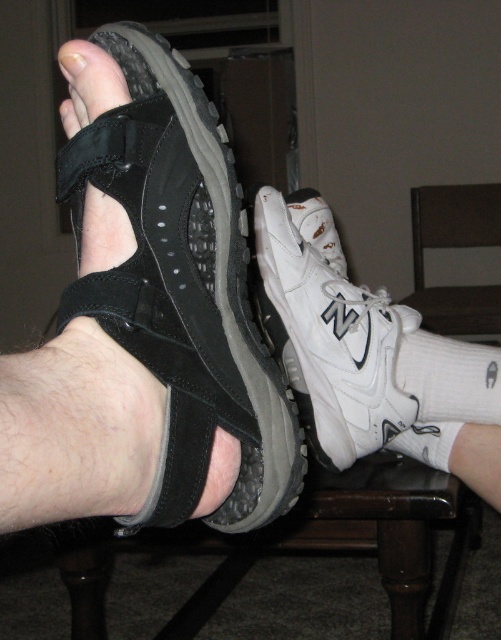
You are trying to determine which item is taller between the white sock at lower right and the white fabric at center. Based on the scene description, which one is taller?

The white sock at lower right is taller than the white fabric at center according to the description.

You are trying to decide which shoe to wear for a short walk. The black suede sandal at left is smaller than the white mesh shoe at center. Which one is more suitable for walking?

The white mesh shoe at center is more suitable for walking because it has a larger size compared to the black suede sandal at left, providing better comfort and support for the foot during the walk.

You are a fashion designer observing two items in the image. You need to decide which item is smaller in size between the white sock at lower right and the white matte nail at center. Which one is smaller?

The white sock at lower right has a smaller size compared to the white matte nail at center, so the white sock at lower right is smaller.